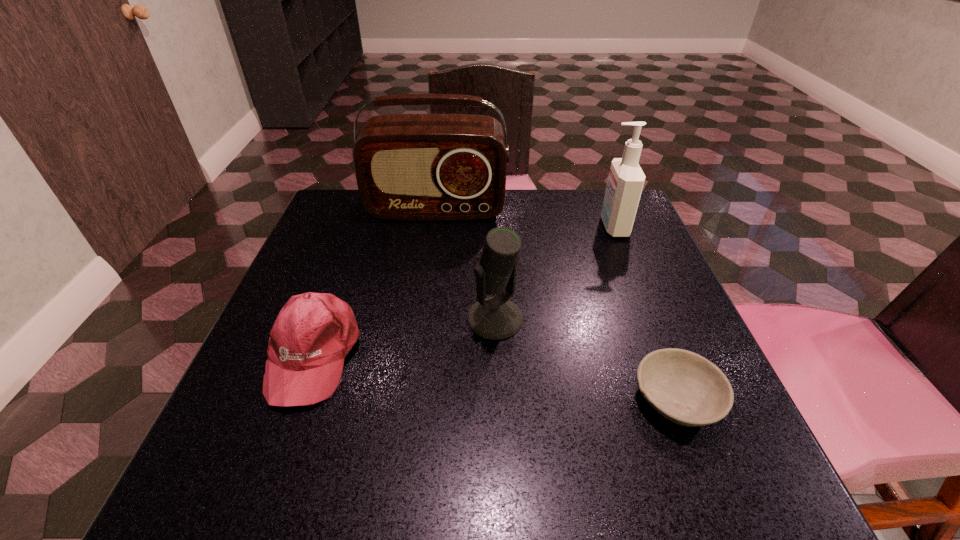
At what (x,y) coordinates should I click in order to perform the action: click on free point between the cleansing agent and the baseball cap. Please return your answer as a coordinate pair (x, y). The width and height of the screenshot is (960, 540). Looking at the image, I should click on (464, 291).

Locate an element on the screen. This screenshot has height=540, width=960. vacant area that lies between the radio receiver and the baseball cap is located at coordinates (375, 282).

The height and width of the screenshot is (540, 960). In order to click on unoccupied area between the microphone and the bowl in this screenshot , I will do `click(586, 359)`.

Image resolution: width=960 pixels, height=540 pixels. What are the coordinates of `free space between the microphone and the second shortest object` in the screenshot? It's located at (404, 336).

At what (x,y) coordinates should I click in order to perform the action: click on free space between the baseball cap and the shortest object. Please return your answer as a coordinate pair (x, y). The image size is (960, 540). Looking at the image, I should click on (495, 377).

I want to click on empty space that is in between the third shortest object and the bowl, so click(586, 359).

Identify which object is the nearest to the baseball cap. Please provide its 2D coordinates. Your answer should be formatted as a tuple, i.e. [(x, y)], where the tuple contains the x and y coordinates of a point satisfying the conditions above.

[(495, 318)]

Identify the location of object identified as the closest to the microphone. (684, 387).

Locate an element on the screen. Image resolution: width=960 pixels, height=540 pixels. vacant space that satisfies the following two spatial constraints: 1. on the front label of the cleansing agent; 2. at the front of the baseball cap with the brim is located at coordinates [x=664, y=355].

Identify the location of vacant area in the image that satisfies the following two spatial constraints: 1. at the front of the bowl with the brim; 2. on the right side of the baseball cap. (298, 399).